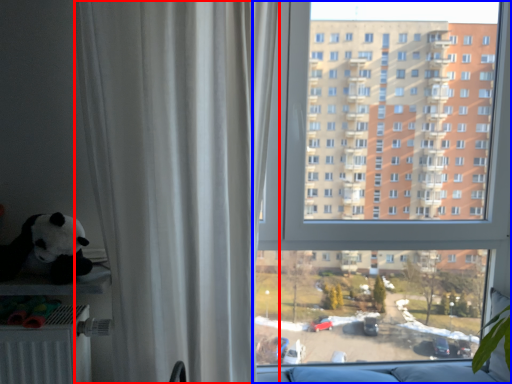
Question: Which of the following is the farthest to the observer, curtain (highlighted by a red box) or window (highlighted by a blue box)?

Choices:
 (A) curtain
 (B) window

Answer: (B)